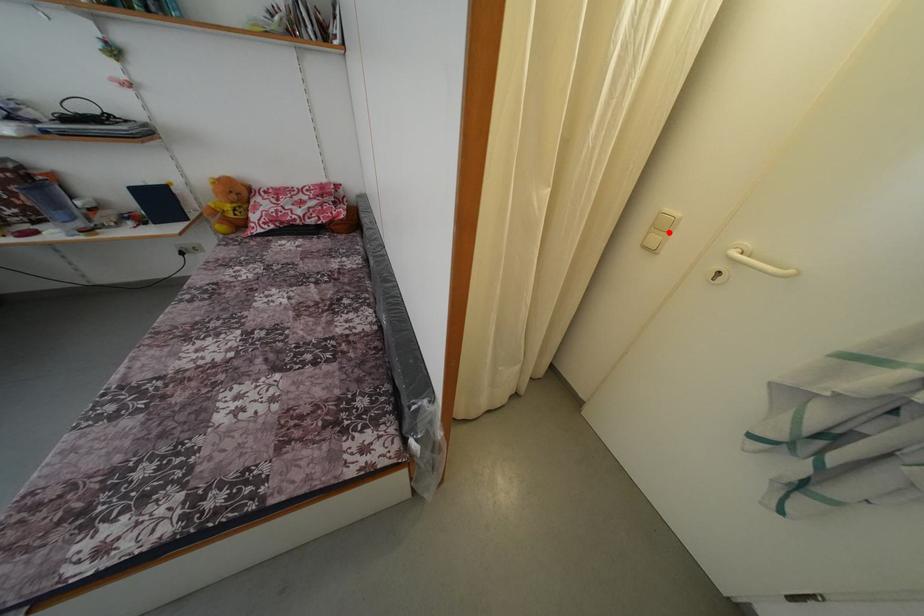
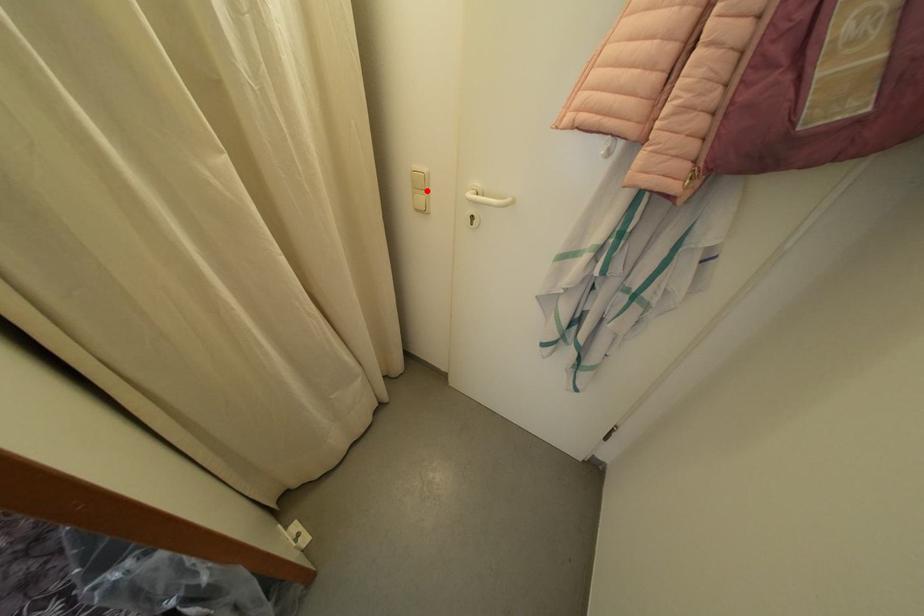
I am providing you with two images of the same scene from different viewpoints. A red point is marked on the first image and another point is marked on the second image. Is the red point in image1 aligned with the point shown in image2?

Yes